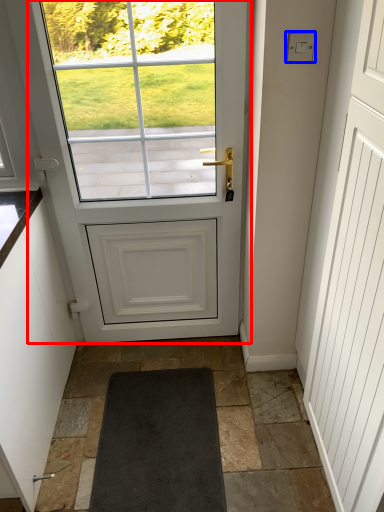
Question: Which of the following is the closest to the observer, door (highlighted by a red box) or lock (highlighted by a blue box)?

Choices:
 (A) door
 (B) lock

Answer: (B)